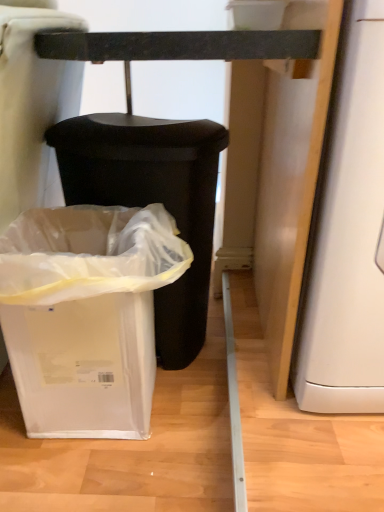
Question: Considering the relative positions of white plastic waste container at lower left, arranged as the 1th waste container when viewed from the back, and white plastic waste container at lower left, the 1th waste container in the front-to-back sequence, in the image provided, is white plastic waste container at lower left, arranged as the 1th waste container when viewed from the back, in front of white plastic waste container at lower left, the 1th waste container in the front-to-back sequence,?

Choices:
 (A) yes
 (B) no

Answer: (B)

Question: Is white plastic waste container at lower left, arranged as the 2th waste container when viewed from the front, at the right side of white plastic waste container at lower left, the 2th waste container viewed from the back?

Choices:
 (A) no
 (B) yes

Answer: (B)

Question: From a real-world perspective, is white plastic waste container at lower left, arranged as the 1th waste container when viewed from the back, physically below white plastic waste container at lower left, the 1th waste container in the front-to-back sequence?

Choices:
 (A) yes
 (B) no

Answer: (B)

Question: From a real-world perspective, does white plastic waste container at lower left, arranged as the 1th waste container when viewed from the back, stand above white plastic waste container at lower left, the 2th waste container viewed from the back?

Choices:
 (A) yes
 (B) no

Answer: (A)

Question: Is white plastic waste container at lower left, arranged as the 1th waste container when viewed from the back, next to white plastic waste container at lower left, the 2th waste container viewed from the back, and touching it?

Choices:
 (A) yes
 (B) no

Answer: (B)

Question: Considering the relative sizes of white plastic waste container at lower left, arranged as the 1th waste container when viewed from the back, and white plastic waste container at lower left, the 2th waste container viewed from the back, in the image provided, is white plastic waste container at lower left, arranged as the 1th waste container when viewed from the back, smaller than white plastic waste container at lower left, the 2th waste container viewed from the back,?

Choices:
 (A) yes
 (B) no

Answer: (B)

Question: From the image's perspective, is white plastic waste container at lower left, the 2th waste container viewed from the back, under white plastic waste container at lower left, arranged as the 1th waste container when viewed from the back?

Choices:
 (A) no
 (B) yes

Answer: (B)

Question: Is white plastic waste container at lower left, the 2th waste container viewed from the back, bigger than white plastic waste container at lower left, arranged as the 1th waste container when viewed from the back?

Choices:
 (A) yes
 (B) no

Answer: (B)

Question: Considering the relative sizes of white plastic waste container at lower left, the 1th waste container in the front-to-back sequence, and white plastic waste container at lower left, arranged as the 2th waste container when viewed from the front, in the image provided, is white plastic waste container at lower left, the 1th waste container in the front-to-back sequence, smaller than white plastic waste container at lower left, arranged as the 2th waste container when viewed from the front,?

Choices:
 (A) yes
 (B) no

Answer: (A)

Question: Can you confirm if white plastic waste container at lower left, the 1th waste container in the front-to-back sequence, is shorter than white plastic waste container at lower left, arranged as the 1th waste container when viewed from the back?

Choices:
 (A) yes
 (B) no

Answer: (A)

Question: Can we say white plastic waste container at lower left, the 2th waste container viewed from the back, lies outside white plastic waste container at lower left, arranged as the 1th waste container when viewed from the back?

Choices:
 (A) no
 (B) yes

Answer: (B)

Question: Does white plastic waste container at lower left, the 2th waste container viewed from the back, have a greater width compared to white plastic waste container at lower left, arranged as the 1th waste container when viewed from the back?

Choices:
 (A) yes
 (B) no

Answer: (B)

Question: Relative to white plastic waste container at lower left, arranged as the 1th waste container when viewed from the back, is white plastic waste container at lower left, the 1th waste container in the front-to-back sequence, in front or behind?

Choices:
 (A) behind
 (B) front

Answer: (B)